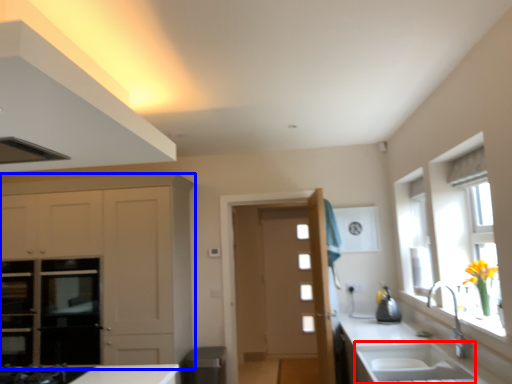
Question: Which point is closer to the camera, sink (highlighted by a red box) or cabinetry (highlighted by a blue box)?

Choices:
 (A) sink
 (B) cabinetry

Answer: (A)